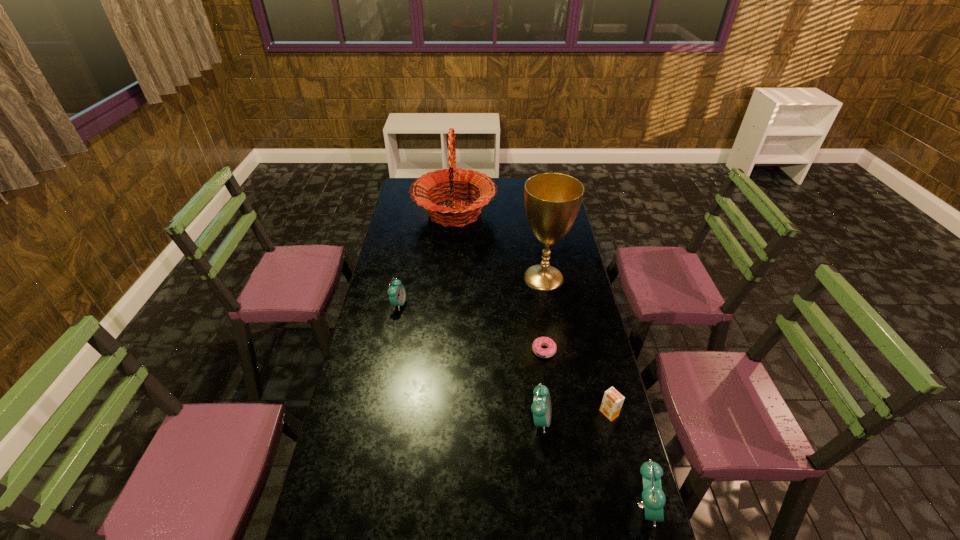
The height and width of the screenshot is (540, 960). Identify the location of free space between the leftmost alarm clock and the fourth farthest object. (471, 327).

You are a GUI agent. You are given a task and a screenshot of the screen. Output one action in this format:
    pyautogui.click(x=<x>, y=<y>)
    Task: Click on the free space between the basket and the fourth nearest object
    
    Given the screenshot: What is the action you would take?
    [x=499, y=282]

Identify the location of blank region between the farthest object and the rightmost alarm clock. (550, 360).

Find the location of a particular element. The image size is (960, 540). free space between the nearest object and the doughnut is located at coordinates (594, 428).

Locate an element on the screen. empty space that is in between the nearest object and the orange juice is located at coordinates (627, 460).

In order to click on free spot between the shortest alarm clock and the second farthest object in this screenshot , I will do `click(471, 291)`.

You are a GUI agent. You are given a task and a screenshot of the screen. Output one action in this format:
    pyautogui.click(x=<x>, y=<y>)
    Task: Click on the unoccupied area between the nearest object and the doughnut
    
    Given the screenshot: What is the action you would take?
    [x=594, y=428]

At what (x,y) coordinates should I click in order to perform the action: click on free space between the second farthest object and the fourth nearest object. Please return your answer as a coordinate pair (x, y). The height and width of the screenshot is (540, 960). Looking at the image, I should click on (543, 314).

Where is `free area in between the orange juice and the leftmost alarm clock`? The height and width of the screenshot is (540, 960). free area in between the orange juice and the leftmost alarm clock is located at coordinates pos(504,359).

Locate which object ranks second in proximity to the fifth nearest object. Please provide its 2D coordinates. Your answer should be formatted as a tuple, i.e. [(x, y)], where the tuple contains the x and y coordinates of a point satisfying the conditions above.

[(552, 200)]